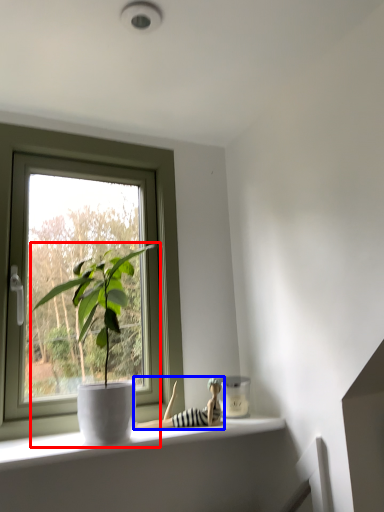
Question: Among these objects, which one is nearest to the camera, houseplant (highlighted by a red box) or toy (highlighted by a blue box)?

Choices:
 (A) houseplant
 (B) toy

Answer: (A)